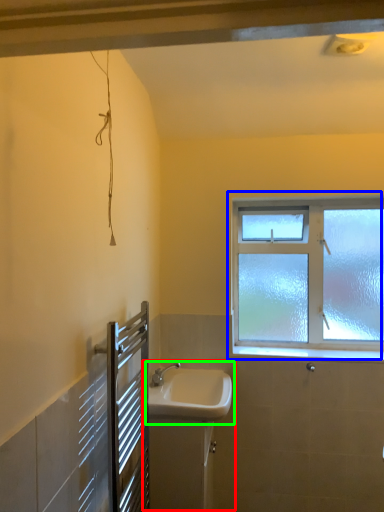
Question: Which is farther away from sink (highlighted by a red box)? window (highlighted by a blue box) or sink (highlighted by a green box)?

Choices:
 (A) window
 (B) sink

Answer: (A)